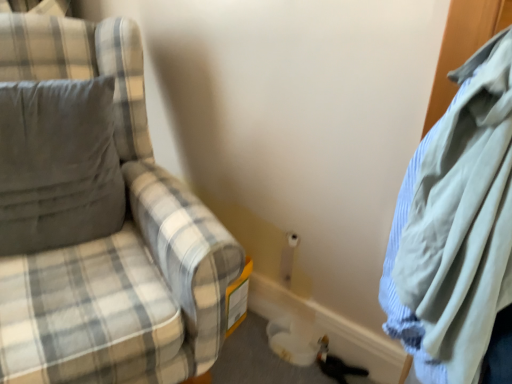
Question: Can plaid fabric chair at left be found inside light blue cotton shirt at right?

Choices:
 (A) no
 (B) yes

Answer: (A)

Question: Does light blue cotton shirt at right have a larger size compared to plaid fabric chair at left?

Choices:
 (A) no
 (B) yes

Answer: (A)

Question: Is light blue cotton shirt at right oriented towards plaid fabric chair at left?

Choices:
 (A) yes
 (B) no

Answer: (B)

Question: Considering the relative sizes of light blue cotton shirt at right and plaid fabric chair at left in the image provided, is light blue cotton shirt at right smaller than plaid fabric chair at left?

Choices:
 (A) no
 (B) yes

Answer: (B)

Question: Is light blue cotton shirt at right placed right next to plaid fabric chair at left?

Choices:
 (A) yes
 (B) no

Answer: (B)

Question: From the image's perspective, is gray fabric pillow at left located above or below light blue cotton shirt at right?

Choices:
 (A) below
 (B) above

Answer: (B)

Question: Relative to light blue cotton shirt at right, is gray fabric pillow at left in front or behind?

Choices:
 (A) front
 (B) behind

Answer: (B)

Question: Is point (60, 102) positioned closer to the camera than point (463, 344)?

Choices:
 (A) closer
 (B) farther

Answer: (B)

Question: Considering the positions of gray fabric pillow at left and light blue cotton shirt at right in the image, is gray fabric pillow at left taller or shorter than light blue cotton shirt at right?

Choices:
 (A) tall
 (B) short

Answer: (B)

Question: Based on their sizes in the image, would you say light blue cotton shirt at right is bigger or smaller than plaid fabric chair at left?

Choices:
 (A) big
 (B) small

Answer: (B)

Question: From a real-world perspective, is light blue cotton shirt at right positioned above or below plaid fabric chair at left?

Choices:
 (A) above
 (B) below

Answer: (A)

Question: Is light blue cotton shirt at right to the left or to the right of plaid fabric chair at left in the image?

Choices:
 (A) left
 (B) right

Answer: (B)

Question: Is point (464, 74) closer or farther from the camera than point (133, 365)?

Choices:
 (A) closer
 (B) farther

Answer: (A)

Question: From the image's perspective, is light blue cotton shirt at right positioned above or below gray fabric pillow at left?

Choices:
 (A) below
 (B) above

Answer: (A)

Question: Is light blue cotton shirt at right taller or shorter than gray fabric pillow at left?

Choices:
 (A) tall
 (B) short

Answer: (A)